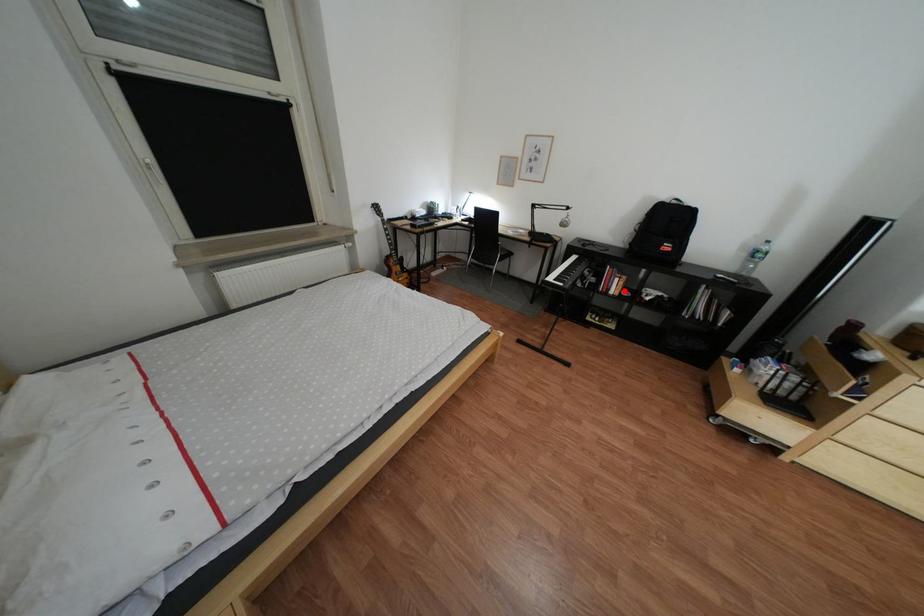
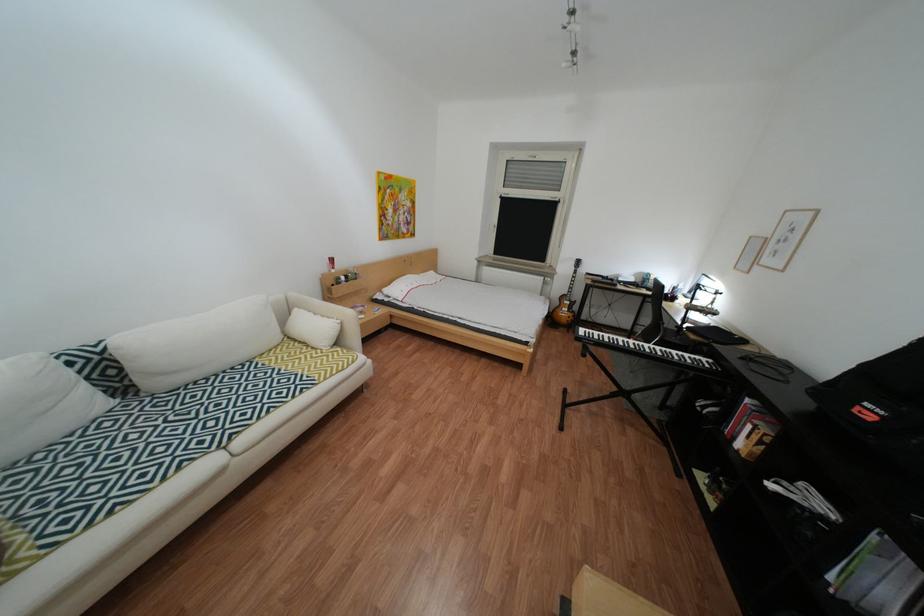
Question: A red point is marked in image1. In image2, is the corresponding 3D point closer to the camera or farther? Reply with the corresponding letter.

Choices:
 (A) The corresponding 3D point is closer.
 (B) The corresponding 3D point is farther.

Answer: (B)